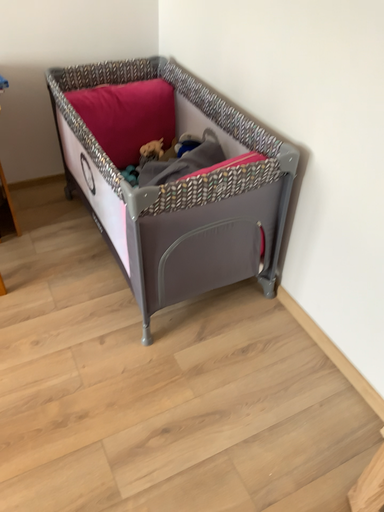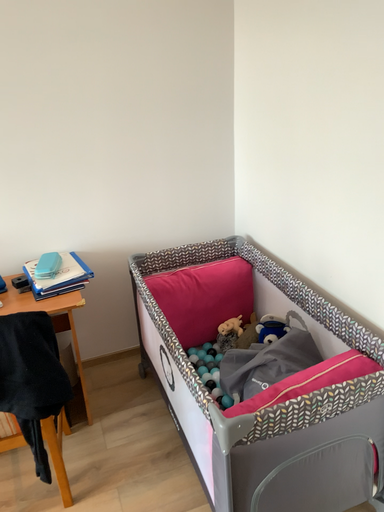
Question: How did the camera likely rotate when shooting the video?

Choices:
 (A) rotated upward
 (B) rotated downward

Answer: (A)